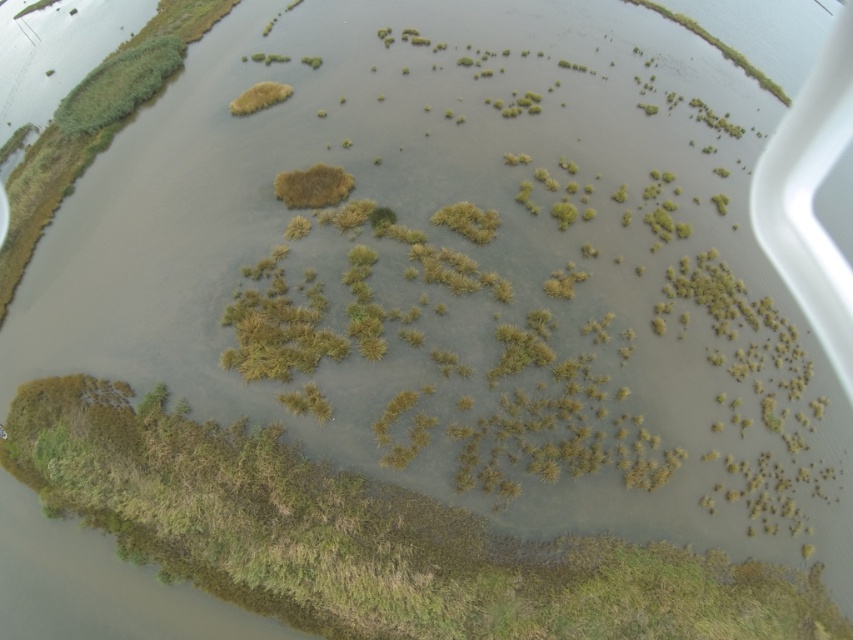
Who is lower down, green grass at upper center or green fuzzy plant at upper center?

green fuzzy plant at upper center is lower down.

What do you see at coordinates (717, 48) in the screenshot? I see `green grass at upper center` at bounding box center [717, 48].

Identify the location of green grass at upper center. (717, 48).